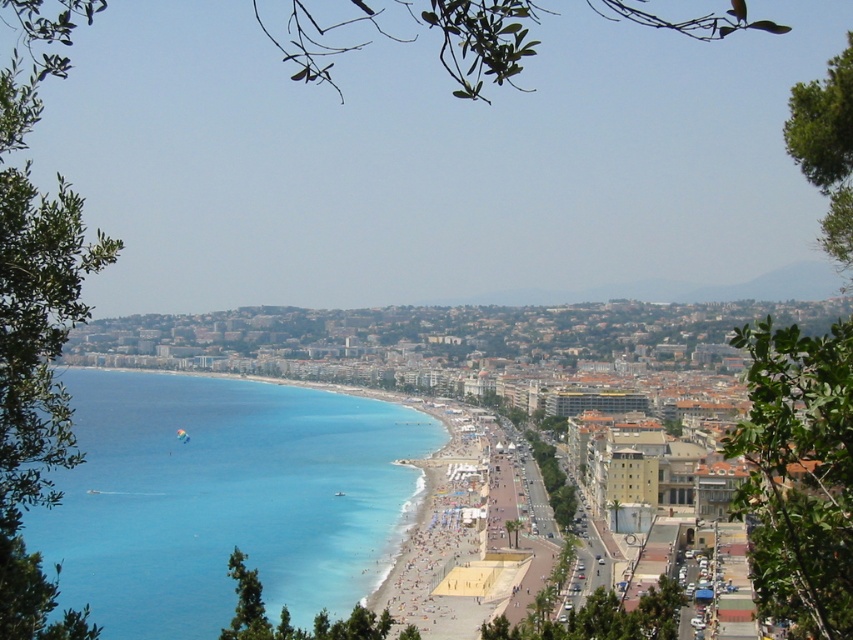
Question: Does blue clear water at lower left come behind beige sand beach at center?

Choices:
 (A) yes
 (B) no

Answer: (B)

Question: Observing the image, what is the correct spatial positioning of blue clear water at lower left in reference to beige sand beach at center?

Choices:
 (A) below
 (B) above

Answer: (B)

Question: Does blue clear water at lower left appear on the left side of beige sand beach at center?

Choices:
 (A) yes
 (B) no

Answer: (A)

Question: Which of the following is the farthest from the observer?

Choices:
 (A) (492, 518)
 (B) (289, 442)

Answer: (B)

Question: Which object is closer to the camera taking this photo?

Choices:
 (A) blue clear water at lower left
 (B) beige sand beach at center

Answer: (A)

Question: Among these objects, which one is farthest from the camera?

Choices:
 (A) beige sand beach at center
 (B) blue clear water at lower left

Answer: (A)